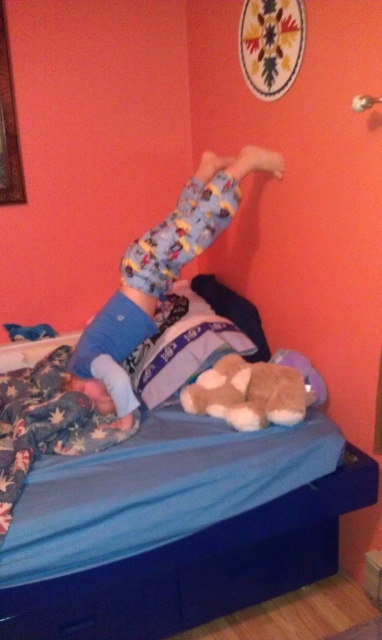
Question: Which point is closer to the camera?

Choices:
 (A) (160, 326)
 (B) (212, 614)
 (C) (189, 230)

Answer: (B)

Question: Estimate the real-world distances between objects in this image. Which object is closer to the blue soft pillow at center?

Choices:
 (A) blue fabric bed at center
 (B) brown plush bear at center
 (C) printed cotton pajama pants at center

Answer: (B)

Question: Can you confirm if printed cotton pajama pants at center is thinner than blue soft pillow at center?

Choices:
 (A) yes
 (B) no

Answer: (B)

Question: Is blue fabric bed at center above blue soft pillow at center?

Choices:
 (A) yes
 (B) no

Answer: (B)

Question: Which point appears farthest from the camera in this image?

Choices:
 (A) (142, 360)
 (B) (29, 634)

Answer: (A)

Question: Does printed cotton pajama pants at center appear under blue soft pillow at center?

Choices:
 (A) yes
 (B) no

Answer: (B)